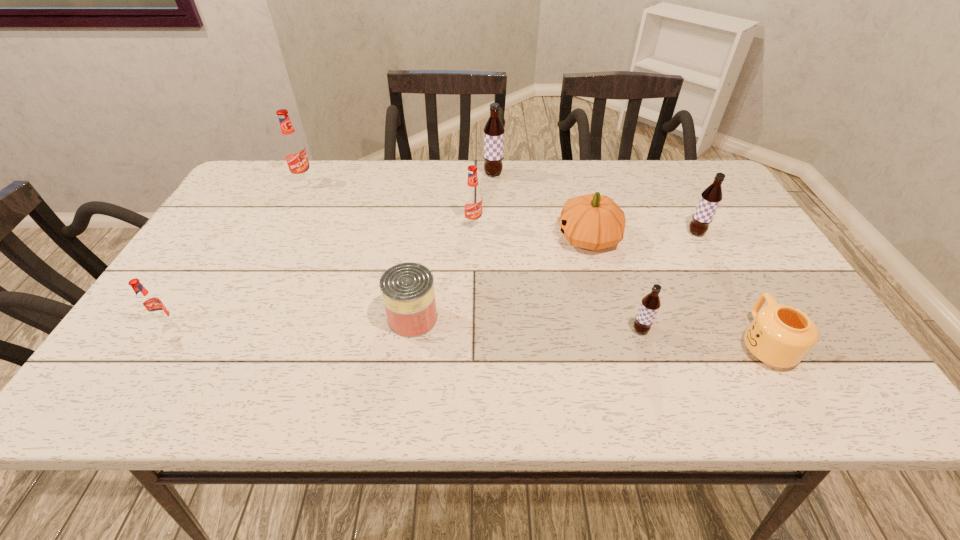
This screenshot has height=540, width=960. Find the location of `vacant area between the nearest brown root beer and the third object from left to right`. vacant area between the nearest brown root beer and the third object from left to right is located at coordinates (526, 324).

Locate an element on the screen. The height and width of the screenshot is (540, 960). free spot between the second smallest brown root beer and the smallest brown root beer is located at coordinates (668, 281).

Where is `vacant area that lies between the rightmost red root beer and the leftmost root beer`? Image resolution: width=960 pixels, height=540 pixels. vacant area that lies between the rightmost red root beer and the leftmost root beer is located at coordinates (320, 274).

At what (x,y) coordinates should I click in order to perform the action: click on free spot between the third root beer from right to left and the fourth root beer from right to left. Please return your answer as a coordinate pair (x, y). Looking at the image, I should click on (483, 199).

Identify the location of object identified as the second closest to the fourth root beer from left to right. (593, 221).

Image resolution: width=960 pixels, height=540 pixels. I want to click on object that stands as the third closest to the farthest brown root beer, so click(407, 289).

Image resolution: width=960 pixels, height=540 pixels. I want to click on the sixth closest root beer to the can, so click(711, 197).

Select which root beer appears as the third closest to the third object from left to right. Please provide its 2D coordinates. Your answer should be formatted as a tuple, i.e. [(x, y)], where the tuple contains the x and y coordinates of a point satisfying the conditions above.

[(151, 305)]

Locate an element on the screen. the third closest brown root beer to the orange gourd is located at coordinates (494, 130).

Choose which brown root beer is the nearest neighbor to the seventh object from right to left. Please provide its 2D coordinates. Your answer should be formatted as a tuple, i.e. [(x, y)], where the tuple contains the x and y coordinates of a point satisfying the conditions above.

[(650, 304)]